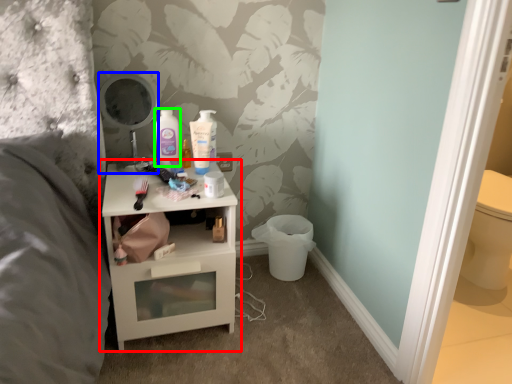
Question: Which object is positioned farthest from nightstand (highlighted by a red box)? Select from mirror (highlighted by a blue box) and mouthwash (highlighted by a green box).

Choices:
 (A) mirror
 (B) mouthwash

Answer: (B)